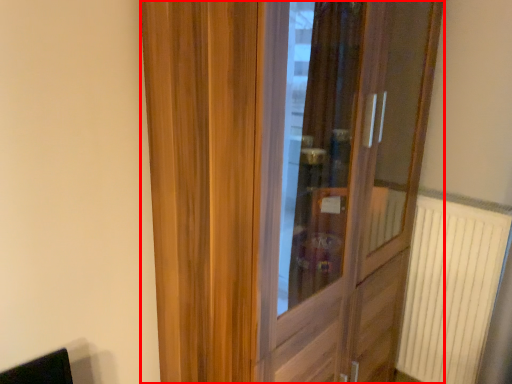
Question: From the image's perspective, what is the correct spatial relationship of door (annotated by the red box) in relation to radiator?

Choices:
 (A) below
 (B) above

Answer: (B)